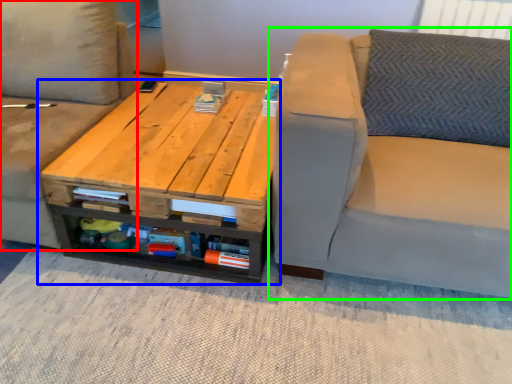
Question: Which is nearer to the studio couch (highlighted by a red box)? table (highlighted by a blue box) or studio couch (highlighted by a green box).

Choices:
 (A) table
 (B) studio couch

Answer: (A)